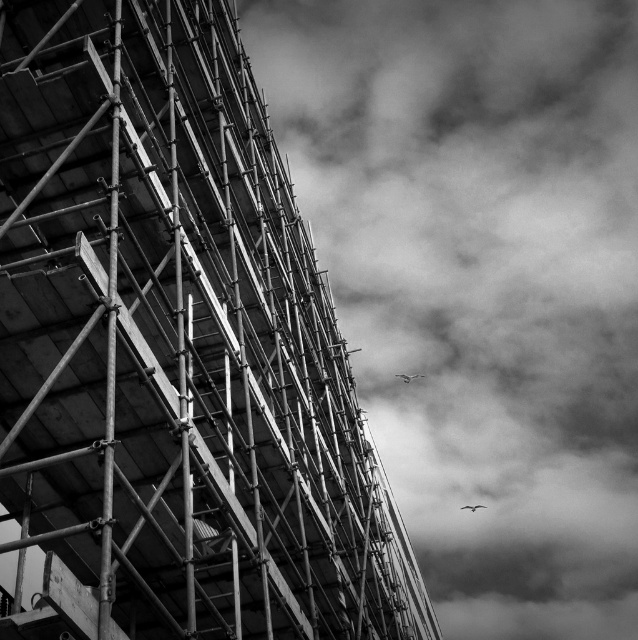
From the picture: You are a photographer trying to capture both the metal scaffolding at left and the gray feathered bird at center in a single shot. Based on their sizes in the image, which one would appear larger in your photograph?

The metal scaffolding at left would appear larger in the photograph because it is bigger than the gray feathered bird at center according to the description.

Consider the image. You are a construction worker standing at the base of the scaffolding on the left side of the image. You need to locate a specific point marked at coordinates point (480, 282). Based on the scene description, where would this point be located relative to the scaffolding and the cloudy sky?

The point (480, 282) is located on the cloudy sky at upper right, which is opposite to the scaffolding on the left side of the image.

You are standing at the point marked as point (x=498, y=81) in the image, which is part of a construction site with scaffolding. You want to know how far you are from the viewer. Can you determine the distance?

The distance between point (x=498, y=81) and the viewer is 1215.09 feet.